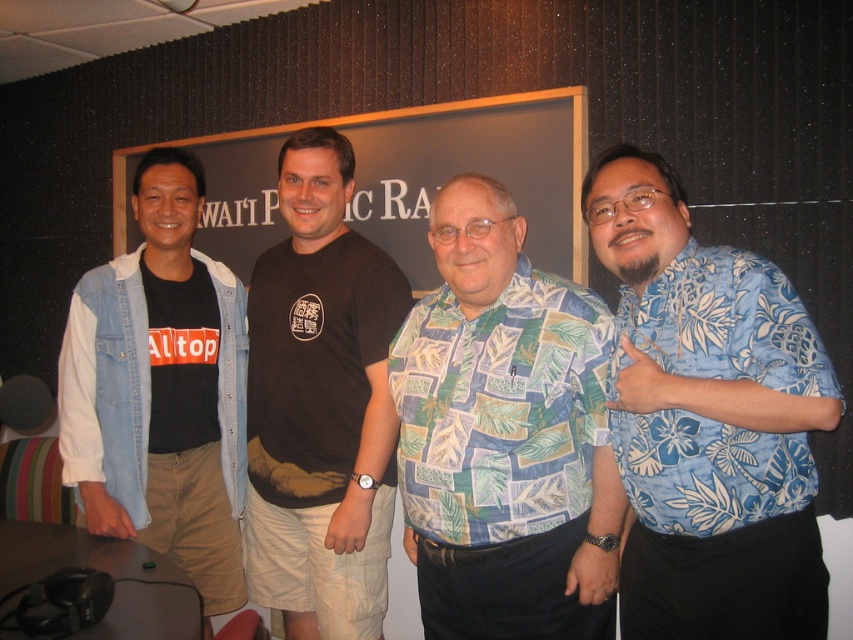
Question: Does printed fabric shirt at center have a larger size compared to matte black signboard at center?

Choices:
 (A) yes
 (B) no

Answer: (B)

Question: Which point appears closest to the camera in this image?

Choices:
 (A) (456, 257)
 (B) (187, 362)
 (C) (334, 433)

Answer: (A)

Question: Does black cotton t-shirt at center have a smaller size compared to denim jacket at left?

Choices:
 (A) yes
 (B) no

Answer: (B)

Question: Which point appears farthest from the camera in this image?

Choices:
 (A) (138, 445)
 (B) (431, 106)
 (C) (604, 419)

Answer: (B)

Question: Is black cotton t-shirt at center bigger than denim jacket at left?

Choices:
 (A) yes
 (B) no

Answer: (A)

Question: Which object is positioned closest to the printed fabric shirt at center?

Choices:
 (A) denim jacket at left
 (B) blue floral shirt at right

Answer: (B)